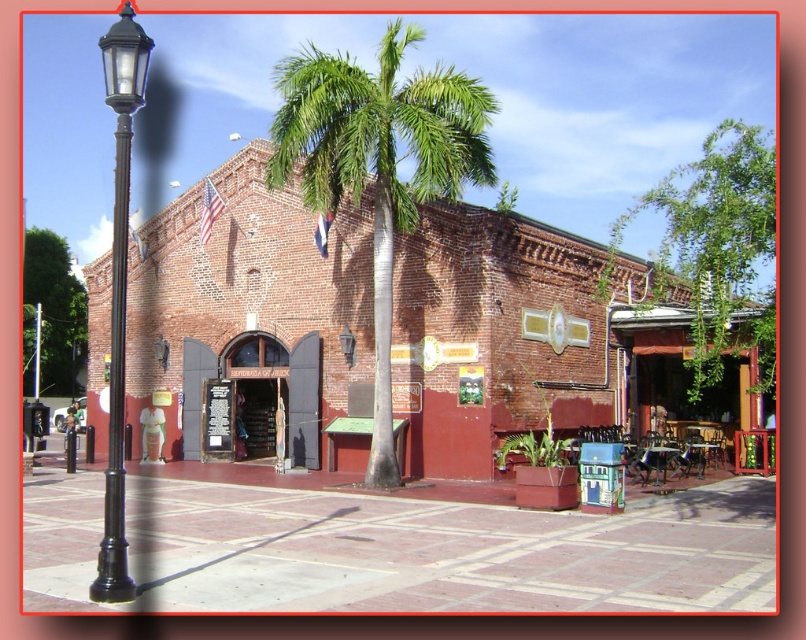
Question: Which of the following is the closest to the observer?

Choices:
 (A) (323, 109)
 (B) (746, 273)
 (C) (152, 44)

Answer: (C)

Question: Can you confirm if green leafy palm tree at center is positioned to the left of green leafy tree at upper left?

Choices:
 (A) no
 (B) yes

Answer: (A)

Question: Is black metal/texture lamp post at left closer to camera compared to green leafy tree at upper left?

Choices:
 (A) yes
 (B) no

Answer: (A)

Question: Which object is closer to the camera taking this photo?

Choices:
 (A) green leafy palm tree at center
 (B) green leafy tree at upper right
 (C) green leafy tree at upper left

Answer: (B)

Question: Estimate the real-world distances between objects in this image. Which object is closer to the black metal/texture lamp post at left?

Choices:
 (A) green leafy palm tree at center
 (B) green leafy tree at upper right

Answer: (A)

Question: Can you confirm if green leafy palm tree at center is smaller than green leafy tree at upper left?

Choices:
 (A) yes
 (B) no

Answer: (B)